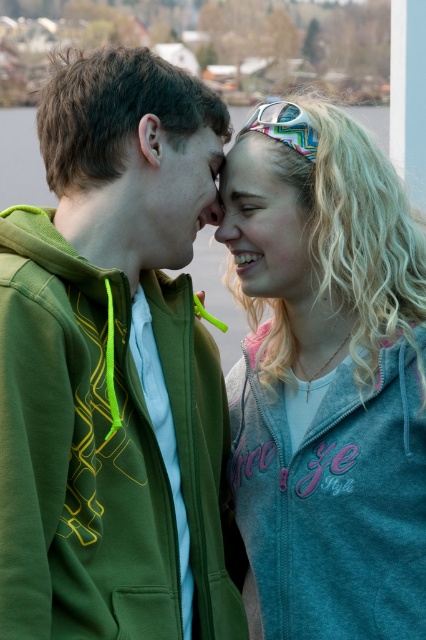
You are a tailor measuring jackets for alterations. You have a 30 cm wide table space. The green fleece jacket at left and gray fleece jacket at right need to be placed side by side. Can both jackets fit on the table space?

The green fleece jacket at left is wider than the gray fleece jacket at right. Since the total width of both jackets combined would exceed the 30 cm table space, they cannot both fit side by side.

You are a photographer trying to capture a close shot of the two people in the image. You want to ensure both the green fleece jacket at left and the smooth skin nose at center are in focus. Since your camera can only focus on one subject at a time, which object should you prioritize focusing on to ensure the larger one is sharp?

The green fleece jacket at left is larger than the smooth skin nose at center, so you should prioritize focusing on the green fleece jacket at left to ensure the larger object is sharp.

Based on the scene description, which fleece jacket, the green fleece jacket at left or the gray fleece jacket at right, is taller?

The green fleece jacket at left is taller than the gray fleece jacket at right.